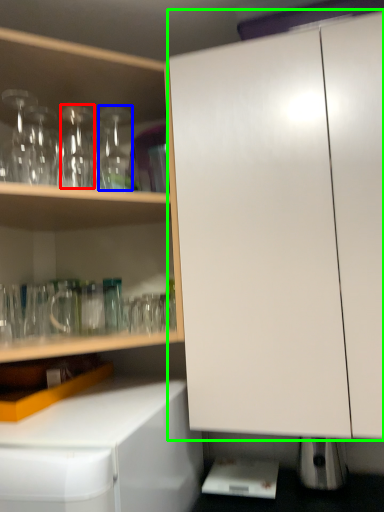
Question: Which object is positioned closest to bottle (highlighted by a red box)? Select from bottle (highlighted by a blue box) and cabinetry (highlighted by a green box).

Choices:
 (A) bottle
 (B) cabinetry

Answer: (A)